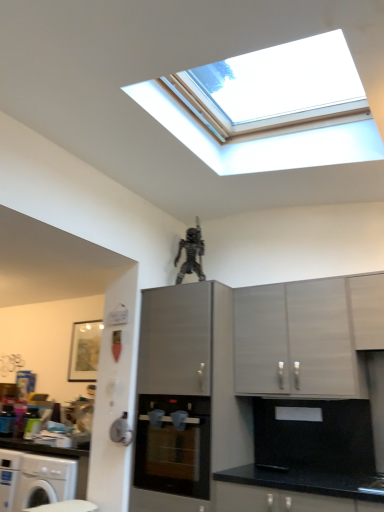
At what (x,y) coordinates should I click in order to perform the action: click on metallic figure at upper center. Please return your answer as a coordinate pair (x, y). Looking at the image, I should click on (191, 254).

What do you see at coordinates (173, 447) in the screenshot? This screenshot has width=384, height=512. I see `matte black oven at center` at bounding box center [173, 447].

This screenshot has height=512, width=384. What do you see at coordinates (367, 310) in the screenshot? I see `white matte cabinet at upper right, the first cabinetry from the right` at bounding box center [367, 310].

Where is `matte gray cabinet at center, which appears as the 2th cabinetry when viewed from the right`? The width and height of the screenshot is (384, 512). matte gray cabinet at center, which appears as the 2th cabinetry when viewed from the right is located at coordinates (306, 335).

Where is `satin grey cabinet at center, positioned as the third cabinetry in right-to-left order`? This screenshot has width=384, height=512. satin grey cabinet at center, positioned as the third cabinetry in right-to-left order is located at coordinates (187, 398).

From the image's perspective, who appears lower, satin grey cabinet at center, the 1th cabinetry positioned from the left, or matte black oven at center?

From the image's view, matte black oven at center is below.

Between satin grey cabinet at center, the 1th cabinetry positioned from the left, and matte black oven at center, which one has larger width?

matte black oven at center.

Is satin grey cabinet at center, positioned as the third cabinetry in right-to-left order, located outside matte black oven at center?

No.

Based on the photo, can you see satin grey cabinet at center, positioned as the third cabinetry in right-to-left order, touching matte black oven at center?

No, satin grey cabinet at center, positioned as the third cabinetry in right-to-left order, is not in contact with matte black oven at center.

Consider the image. Is matte gray cabinet at center, the second cabinetry positioned from the left, in front of or behind white matte cabinet at upper right, the first cabinetry from the right, in the image?

Clearly, matte gray cabinet at center, the second cabinetry positioned from the left, is behind white matte cabinet at upper right, the first cabinetry from the right.

Can you confirm if matte gray cabinet at center, the second cabinetry positioned from the left, is smaller than white matte cabinet at upper right, arranged as the third cabinetry when viewed from the left?

No, matte gray cabinet at center, the second cabinetry positioned from the left, is not smaller than white matte cabinet at upper right, arranged as the third cabinetry when viewed from the left.

Which object is positioned more to the left, matte gray cabinet at center, which appears as the 2th cabinetry when viewed from the right, or white matte cabinet at upper right, the first cabinetry from the right?

Positioned to the left is matte gray cabinet at center, which appears as the 2th cabinetry when viewed from the right.

Is there a large distance between matte gray cabinet at center, the second cabinetry positioned from the left, and white matte cabinet at upper right, arranged as the third cabinetry when viewed from the left?

No, matte gray cabinet at center, the second cabinetry positioned from the left, is in close proximity to white matte cabinet at upper right, arranged as the third cabinetry when viewed from the left.

Between metallic figure at upper center and white matte cabinet at upper right, arranged as the third cabinetry when viewed from the left, which one has larger width?

white matte cabinet at upper right, arranged as the third cabinetry when viewed from the left, is wider.

Between metallic figure at upper center and white matte cabinet at upper right, arranged as the third cabinetry when viewed from the left, which one appears on the left side from the viewer's perspective?

Positioned to the left is metallic figure at upper center.

From a real-world perspective, who is located lower, metallic figure at upper center or white matte cabinet at upper right, the first cabinetry from the right?

white matte cabinet at upper right, the first cabinetry from the right.

Who is more distant, metallic figure at upper center or white matte cabinet at upper right, the first cabinetry from the right?

metallic figure at upper center is behind.

Image resolution: width=384 pixels, height=512 pixels. In order to click on home appliance behind the matte gray cabinet at center, the second cabinetry positioned from the left in this screenshot , I will do `click(173, 447)`.

Considering the sizes of objects matte black oven at center and matte gray cabinet at center, which appears as the 2th cabinetry when viewed from the right, in the image provided, who is taller, matte black oven at center or matte gray cabinet at center, which appears as the 2th cabinetry when viewed from the right,?

Standing taller between the two is matte gray cabinet at center, which appears as the 2th cabinetry when viewed from the right.

Measure the distance from matte black oven at center to matte gray cabinet at center, the second cabinetry positioned from the left.

They are 27.93 inches apart.

From a real-world perspective, is matte black oven at center on top of matte gray cabinet at center, the second cabinetry positioned from the left?

No.

Is matte gray cabinet at center, which appears as the 2th cabinetry when viewed from the right, to the left or to the right of matte black oven at center in the image?

matte gray cabinet at center, which appears as the 2th cabinetry when viewed from the right, is to the right of matte black oven at center.

Does matte gray cabinet at center, which appears as the 2th cabinetry when viewed from the right, have a smaller size compared to matte black oven at center?

Yes, matte gray cabinet at center, which appears as the 2th cabinetry when viewed from the right, is smaller than matte black oven at center.

Is matte gray cabinet at center, which appears as the 2th cabinetry when viewed from the right, thinner than matte black oven at center?

Indeed, matte gray cabinet at center, which appears as the 2th cabinetry when viewed from the right, has a lesser width compared to matte black oven at center.

Considering the points (270, 354) and (163, 401), which point is in front, point (270, 354) or point (163, 401)?

The point (270, 354) is closer.

From the image's perspective, is satin grey cabinet at center, positioned as the third cabinetry in right-to-left order, above or below matte gray cabinet at center, which appears as the 2th cabinetry when viewed from the right?

From the image's perspective, satin grey cabinet at center, positioned as the third cabinetry in right-to-left order, appears below matte gray cabinet at center, which appears as the 2th cabinetry when viewed from the right.

Can you confirm if satin grey cabinet at center, positioned as the third cabinetry in right-to-left order, is bigger than matte gray cabinet at center, the second cabinetry positioned from the left?

Correct, satin grey cabinet at center, positioned as the third cabinetry in right-to-left order, is larger in size than matte gray cabinet at center, the second cabinetry positioned from the left.

Is satin grey cabinet at center, the 1th cabinetry positioned from the left, oriented towards matte gray cabinet at center, the second cabinetry positioned from the left?

No.

From the picture: Between satin grey cabinet at center, positioned as the third cabinetry in right-to-left order, and matte gray cabinet at center, the second cabinetry positioned from the left, which one appears on the left side from the viewer's perspective?

From the viewer's perspective, satin grey cabinet at center, positioned as the third cabinetry in right-to-left order, appears more on the left side.

Is white matte cabinet at upper right, arranged as the third cabinetry when viewed from the left, far away from satin grey cabinet at center, the 1th cabinetry positioned from the left?

Yes, white matte cabinet at upper right, arranged as the third cabinetry when viewed from the left, and satin grey cabinet at center, the 1th cabinetry positioned from the left, are quite far apart.

Do you think white matte cabinet at upper right, arranged as the third cabinetry when viewed from the left, is within satin grey cabinet at center, the 1th cabinetry positioned from the left, or outside of it?

The correct answer is: outside.

Between white matte cabinet at upper right, the first cabinetry from the right, and satin grey cabinet at center, the 1th cabinetry positioned from the left, which one appears on the right side from the viewer's perspective?

white matte cabinet at upper right, the first cabinetry from the right, is more to the right.

From the image's perspective, is white matte cabinet at upper right, arranged as the third cabinetry when viewed from the left, located above or below satin grey cabinet at center, positioned as the third cabinetry in right-to-left order?

Clearly, from the image's perspective, white matte cabinet at upper right, arranged as the third cabinetry when viewed from the left, is above satin grey cabinet at center, positioned as the third cabinetry in right-to-left order.

Locate an element on the screen. home appliance below the satin grey cabinet at center, the 1th cabinetry positioned from the left (from a real-world perspective) is located at coordinates (173, 447).

Find the location of a particular element. The height and width of the screenshot is (512, 384). cabinetry above the matte gray cabinet at center, the second cabinetry positioned from the left (from a real-world perspective) is located at coordinates (367, 310).

Considering their positions, is satin grey cabinet at center, the 1th cabinetry positioned from the left, positioned further to metallic figure at upper center than white matte cabinet at upper right, arranged as the third cabinetry when viewed from the left?

The object further to metallic figure at upper center is white matte cabinet at upper right, arranged as the third cabinetry when viewed from the left.

From the image, which object appears to be farther from matte black oven at center, matte gray cabinet at center, which appears as the 2th cabinetry when viewed from the right, or satin grey cabinet at center, the 1th cabinetry positioned from the left?

matte gray cabinet at center, which appears as the 2th cabinetry when viewed from the right, is further to matte black oven at center.

Based on their spatial positions, is white matte cabinet at upper right, the first cabinetry from the right, or satin grey cabinet at center, the 1th cabinetry positioned from the left, closer to matte gray cabinet at center, the second cabinetry positioned from the left?

white matte cabinet at upper right, the first cabinetry from the right, is closer to matte gray cabinet at center, the second cabinetry positioned from the left.

When comparing their distances from matte gray cabinet at center, which appears as the 2th cabinetry when viewed from the right, does satin grey cabinet at center, positioned as the third cabinetry in right-to-left order, or white matte cabinet at upper right, the first cabinetry from the right, seem closer?

white matte cabinet at upper right, the first cabinetry from the right.

Considering their positions, is white matte cabinet at upper right, the first cabinetry from the right, positioned closer to metallic figure at upper center than matte gray cabinet at center, which appears as the 2th cabinetry when viewed from the right?

The object closer to metallic figure at upper center is matte gray cabinet at center, which appears as the 2th cabinetry when viewed from the right.

Based on their spatial positions, is matte gray cabinet at center, the second cabinetry positioned from the left, or metallic figure at upper center closer to satin grey cabinet at center, the 1th cabinetry positioned from the left?

matte gray cabinet at center, the second cabinetry positioned from the left, is positioned closer to the anchor satin grey cabinet at center, the 1th cabinetry positioned from the left.

Which object lies further to the anchor point metallic figure at upper center, matte gray cabinet at center, the second cabinetry positioned from the left, or satin grey cabinet at center, the 1th cabinetry positioned from the left?

matte gray cabinet at center, the second cabinetry positioned from the left, lies further to metallic figure at upper center than the other object.

Estimate the real-world distances between objects in this image. Which object is closer to satin grey cabinet at center, positioned as the third cabinetry in right-to-left order, matte black oven at center or metallic figure at upper center?

matte black oven at center.

Locate an element on the screen. This screenshot has height=512, width=384. home appliance between metallic figure at upper center and white matte cabinet at upper right, the first cabinetry from the right is located at coordinates (173, 447).

Locate an element on the screen. Image resolution: width=384 pixels, height=512 pixels. home appliance located between satin grey cabinet at center, positioned as the third cabinetry in right-to-left order, and matte gray cabinet at center, the second cabinetry positioned from the left, in the left-right direction is located at coordinates (173, 447).

This screenshot has width=384, height=512. Find the location of `cabinetry located between matte black oven at center and white matte cabinet at upper right, the first cabinetry from the right, in the left-right direction`. cabinetry located between matte black oven at center and white matte cabinet at upper right, the first cabinetry from the right, in the left-right direction is located at coordinates (306, 335).

At what (x,y) coordinates should I click in order to perform the action: click on cabinetry between satin grey cabinet at center, positioned as the third cabinetry in right-to-left order, and white matte cabinet at upper right, the first cabinetry from the right, in the horizontal direction. Please return your answer as a coordinate pair (x, y). Looking at the image, I should click on (306, 335).